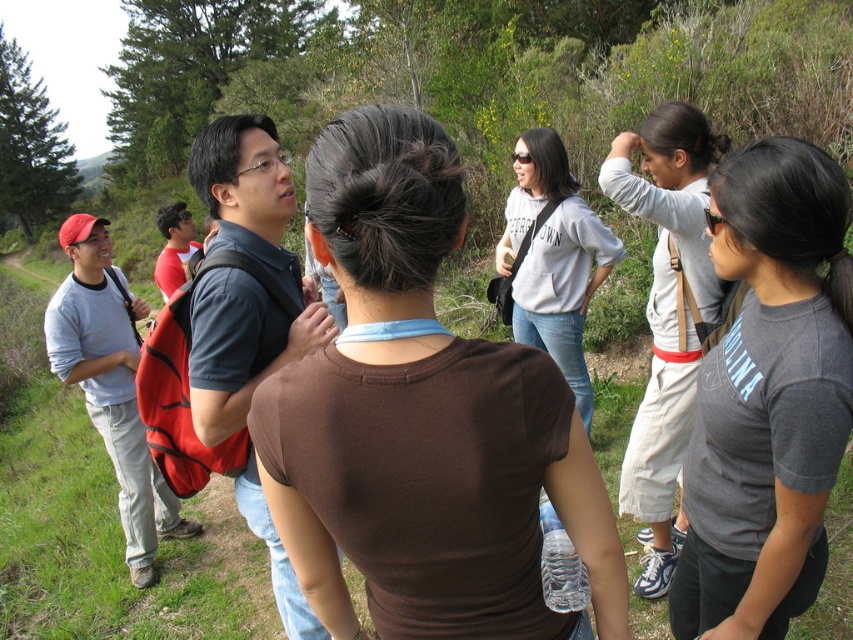
Between point (355, 508) and point (628, 513), which one is positioned behind?

The point (628, 513) is behind.

Can you confirm if brown cotton shirt at center is positioned to the left of light gray cotton shirt at upper right?

→ Indeed, brown cotton shirt at center is positioned on the left side of light gray cotton shirt at upper right.

Does point (352, 445) come closer to viewer compared to point (665, 268)?

Yes.

At what (x,y) coordinates should I click in order to perform the action: click on brown cotton shirt at center. Please return your answer as a coordinate pair (x, y). Looking at the image, I should click on (422, 420).

Does point (440, 380) come farther from viewer compared to point (840, 269)?

No.

Between point (438, 355) and point (776, 564), which one is positioned in front?

Positioned in front is point (438, 355).

The width and height of the screenshot is (853, 640). Find the location of `brown cotton shirt at center`. brown cotton shirt at center is located at coordinates (422, 420).

Does gray cotton t-shirt at upper right appear on the left side of light gray cotton shirt at upper right?

Correct, you'll find gray cotton t-shirt at upper right to the left of light gray cotton shirt at upper right.

Measure the distance between point (x=798, y=442) and camera.

4.63 feet

Find the location of a particular element. The height and width of the screenshot is (640, 853). gray cotton t-shirt at upper right is located at coordinates (769, 396).